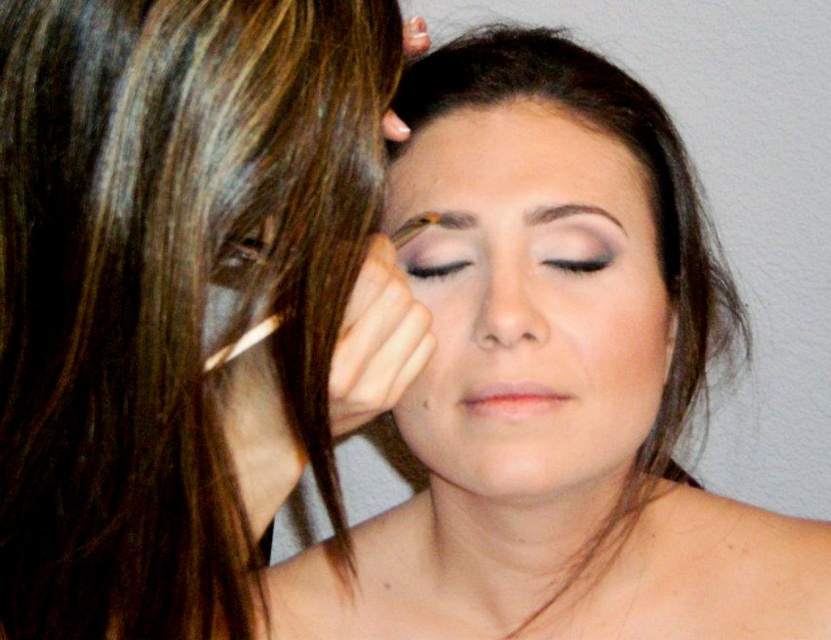
Between smooth skin at center and matte black eyeliner at center, which one is positioned higher?

smooth skin at center

Who is positioned more to the left, smooth skin at center or matte black eyeliner at center?

matte black eyeliner at center

Measure the distance between smooth skin at center and camera.

18.26 inches

I want to click on smooth skin at center, so click(x=571, y=120).

Does matte purple eyeshadow at center appear on the left side of smooth skin at center?

In fact, matte purple eyeshadow at center is to the right of smooth skin at center.

Measure the distance from matte purple eyeshadow at center to smooth skin at center.

A distance of 3.11 inches exists between matte purple eyeshadow at center and smooth skin at center.

You are a GUI agent. You are given a task and a screenshot of the screen. Output one action in this format:
    pyautogui.click(x=<x>, y=<y>)
    Task: Click on the matte purple eyeshadow at center
    Image resolution: width=831 pixels, height=640 pixels.
    Given the screenshot: What is the action you would take?
    pyautogui.click(x=530, y=301)

Which is more to the right, brown matte eyebrow at upper center or matte brown eyebrow at upper center?

Positioned to the right is matte brown eyebrow at upper center.

Measure the distance from brown matte eyebrow at upper center to matte brown eyebrow at upper center.

They are 1.84 inches apart.

You are a GUI agent. You are given a task and a screenshot of the screen. Output one action in this format:
    pyautogui.click(x=<x>, y=<y>)
    Task: Click on the brown matte eyebrow at upper center
    
    Given the screenshot: What is the action you would take?
    pyautogui.click(x=429, y=225)